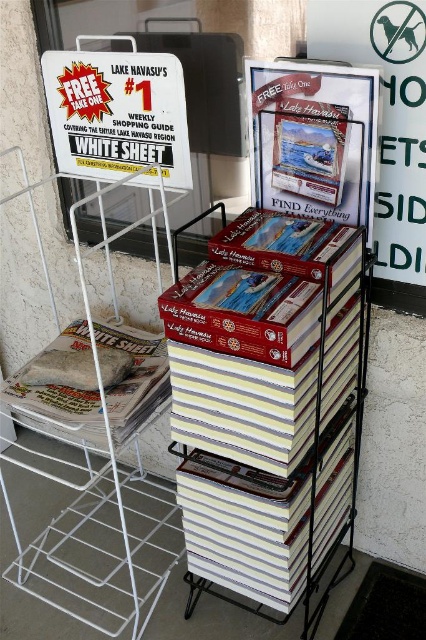
What do you see at coordinates (267, 403) in the screenshot?
I see `white glossy book at center` at bounding box center [267, 403].

Who is taller, white glossy book at center or white paper bag at lower left?

Standing taller between the two is white glossy book at center.

Find the location of a particular element. The height and width of the screenshot is (640, 426). white glossy book at center is located at coordinates (267, 403).

Who is more distant from viewer, (94, 392) or (334, 106)?

The point (94, 392) is more distant.

Is point (146, 358) positioned behind point (278, 148)?

Yes, point (146, 358) is farther from viewer.

Locate an element on the screen. white paper bag at lower left is located at coordinates (135, 378).

Can you confirm if white paper sign at upper left is wider than white paper bag at lower left?

Incorrect, white paper sign at upper left's width does not surpass white paper bag at lower left's.

Who is higher up, white paper sign at upper left or white paper bag at lower left?

Positioned higher is white paper sign at upper left.

This screenshot has height=640, width=426. Find the location of `white paper sign at upper left`. white paper sign at upper left is located at coordinates (118, 115).

The image size is (426, 640). What are the coordinates of `white paper sign at upper left` in the screenshot? It's located at (118, 115).